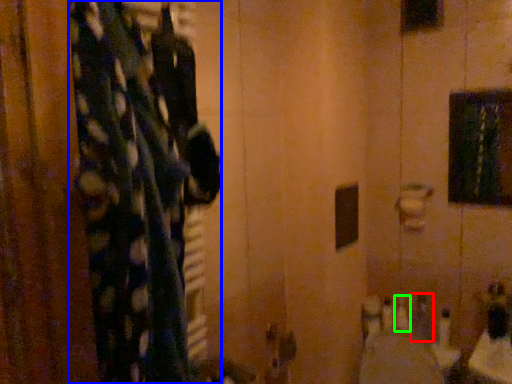
Question: Which object is positioned farthest from toiletry (highlighted by a red box)? Select from curtain (highlighted by a blue box) and toiletry (highlighted by a green box).

Choices:
 (A) curtain
 (B) toiletry

Answer: (A)